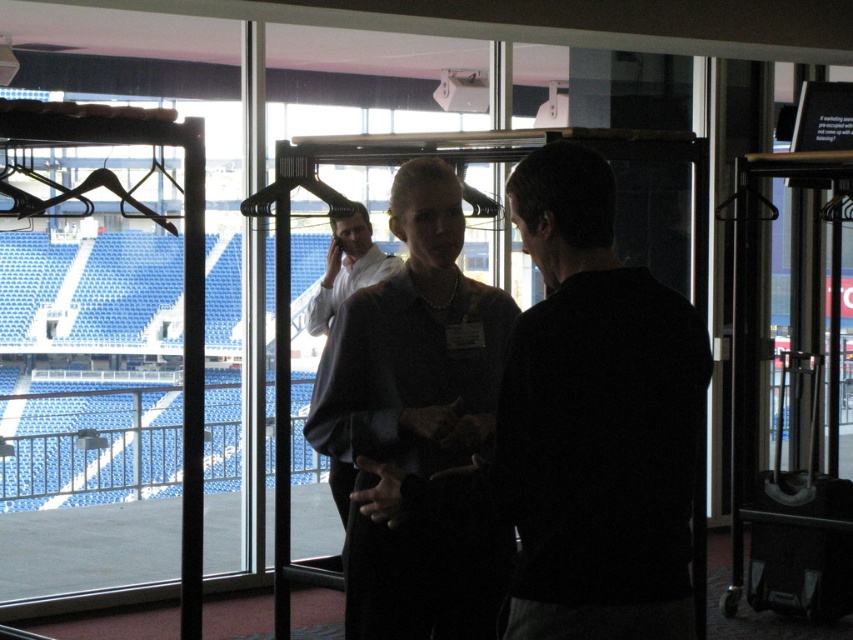
Question: Is dark gray sweater at center closer to the viewer compared to matte white shirt at center?

Choices:
 (A) yes
 (B) no

Answer: (A)

Question: Which is nearer to the dark gray sweater at center?

Choices:
 (A) matte black blouse at center
 (B) matte white shirt at center

Answer: (A)

Question: Can you confirm if dark gray sweater at center is wider than matte white shirt at center?

Choices:
 (A) no
 (B) yes

Answer: (B)

Question: Which object appears closest to the camera in this image?

Choices:
 (A) matte white shirt at center
 (B) dark gray sweater at center

Answer: (B)

Question: Which object is positioned farthest from the matte black blouse at center?

Choices:
 (A) matte white shirt at center
 (B) dark gray sweater at center

Answer: (A)

Question: Is dark gray sweater at center bigger than matte black blouse at center?

Choices:
 (A) yes
 (B) no

Answer: (B)